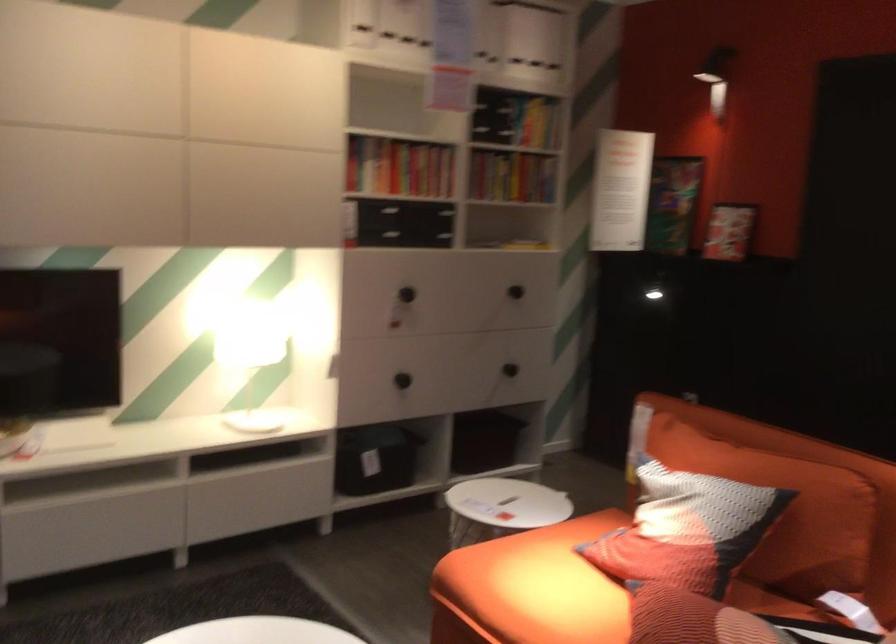
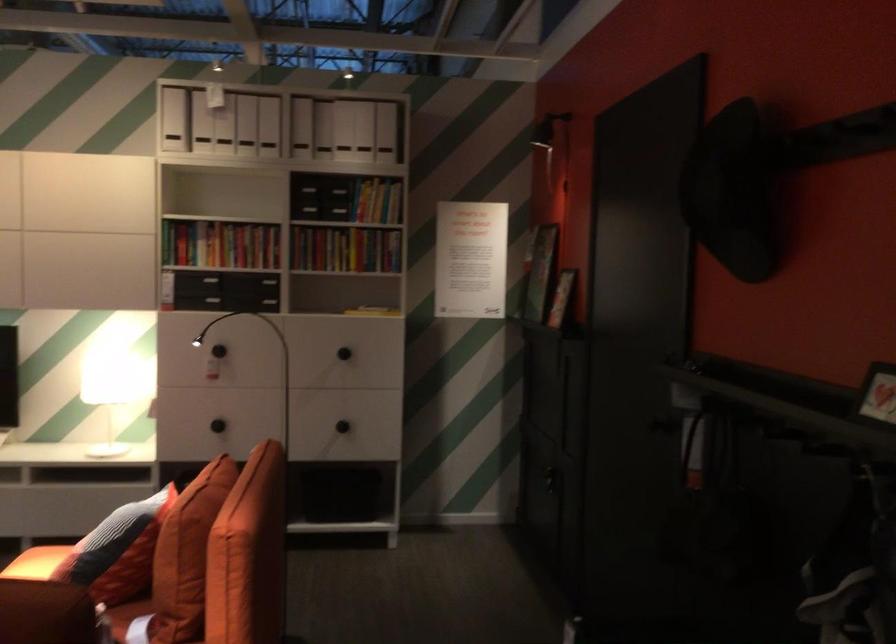
Find the pixel in the second image that matches [432,375] in the first image.

(218, 426)